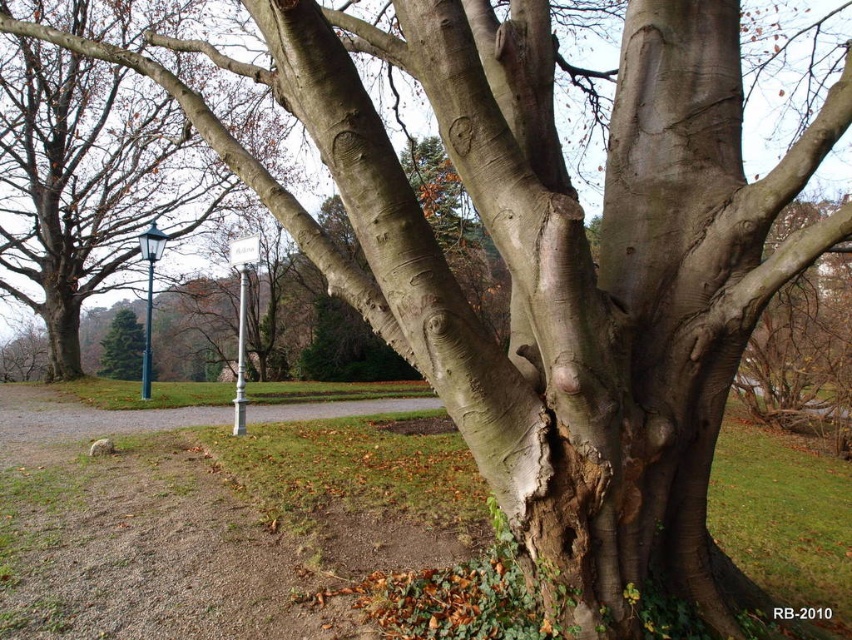
Question: In this image, where is smooth gray bark at center located relative to white plastic sign at upper center?

Choices:
 (A) left
 (B) right

Answer: (A)

Question: Which of these objects is positioned farthest from the white metallic street sign at lower left?

Choices:
 (A) smooth gray bark at center
 (B) green glass street sign at left
 (C) green matte pine tree at center

Answer: (A)

Question: Which of the following is the closest to the observer?

Choices:
 (A) green glass street sign at left
 (B) smooth gray bark at center
 (C) white plastic sign at upper center

Answer: (C)

Question: Can you confirm if green matte pine tree at center is thinner than green glass street sign at left?

Choices:
 (A) no
 (B) yes

Answer: (A)

Question: Estimate the real-world distances between objects in this image. Which object is farther from the white plastic sign at upper center?

Choices:
 (A) green matte pine tree at center
 (B) white metallic street sign at lower left

Answer: (A)

Question: Can you confirm if smooth gray bark at center is smaller than green matte pine tree at center?

Choices:
 (A) no
 (B) yes

Answer: (B)